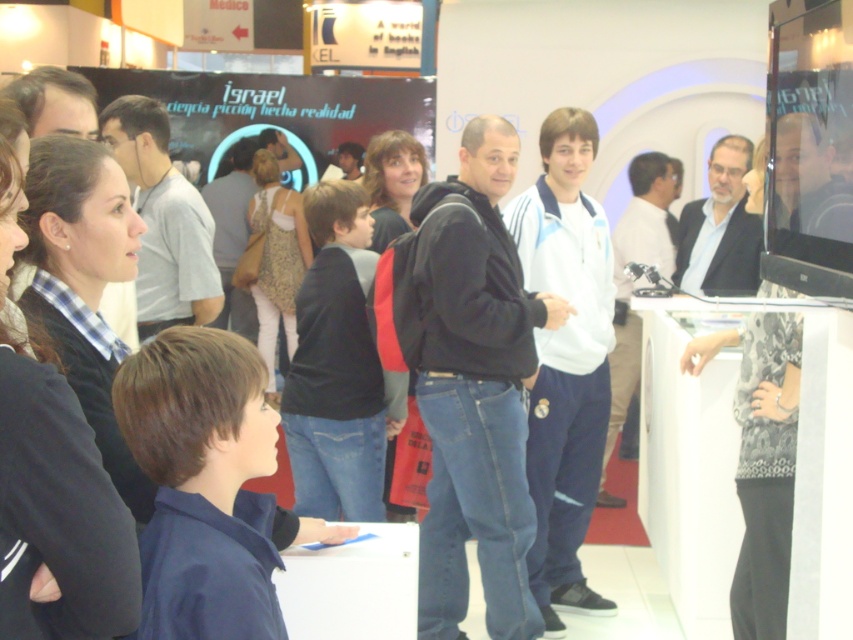
Question: Is matte black suit at upper right to the right of light blue jeans at center from the viewer's perspective?

Choices:
 (A) no
 (B) yes

Answer: (B)

Question: Does matte black jacket at center appear over matte black jacket at upper left?

Choices:
 (A) no
 (B) yes

Answer: (A)

Question: Which of these objects is positioned farthest from the black matte jacket at center?

Choices:
 (A) matte black jacket at center
 (B) white fleece jacket at center

Answer: (A)

Question: Does matte black jacket at center appear over light brown leather jacket at center?

Choices:
 (A) no
 (B) yes

Answer: (A)

Question: Which object is the farthest from the matte black jacket at upper left?

Choices:
 (A) matte black suit at upper right
 (B) light blue jeans at center

Answer: (B)

Question: Which object is closer to the camera taking this photo?

Choices:
 (A) matte black suit at upper right
 (B) white fleece jacket at center
 (C) matte black jacket at center

Answer: (C)